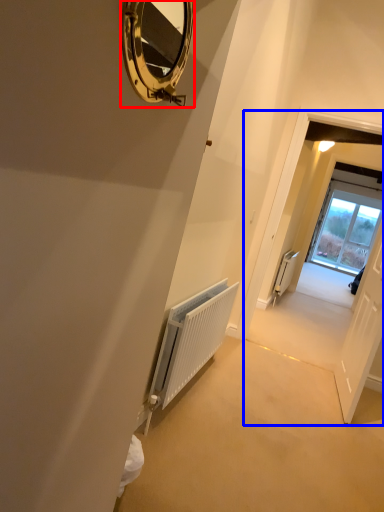
Question: Among these objects, which one is nearest to the camera, mirror (highlighted by a red box) or corridor (highlighted by a blue box)?

Choices:
 (A) mirror
 (B) corridor

Answer: (A)